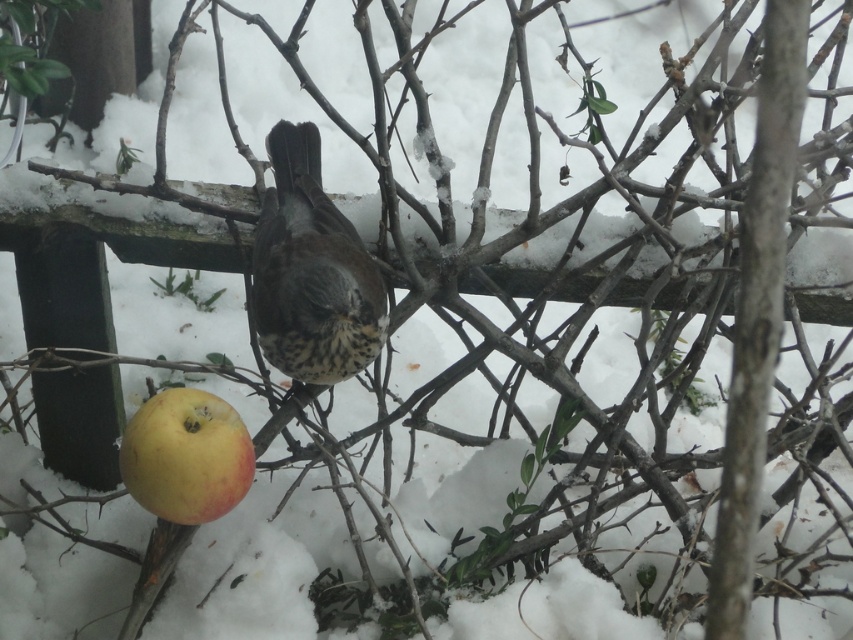
Can you confirm if speckled brown bird at center is smaller than yellow matte apple at lower left?

No, speckled brown bird at center is not smaller than yellow matte apple at lower left.

Between speckled brown bird at center and yellow matte apple at lower left, which one appears on the right side from the viewer's perspective?

Positioned to the right is speckled brown bird at center.

The height and width of the screenshot is (640, 853). Describe the element at coordinates (311, 272) in the screenshot. I see `speckled brown bird at center` at that location.

Identify the location of speckled brown bird at center. The image size is (853, 640). (311, 272).